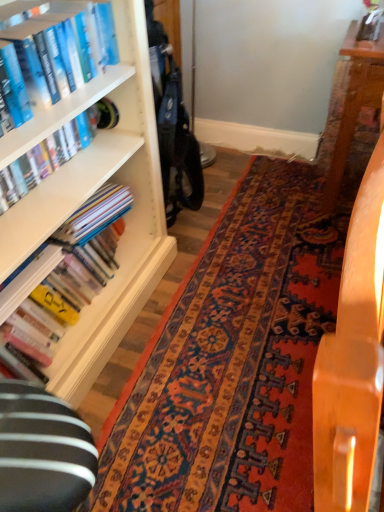
The image size is (384, 512). I want to click on wooden table at center, so click(x=353, y=359).

Measure the distance between blue hardcover book at upper left, acting as the first book starting from the top, and camera.

blue hardcover book at upper left, acting as the first book starting from the top, and camera are 1.02 meters apart from each other.

I want to click on hardcover book at left, which is counted as the 2th book, starting from the bottom, so click(x=46, y=157).

You are a GUI agent. You are given a task and a screenshot of the screen. Output one action in this format:
    pyautogui.click(x=<x>, y=<y>)
    Task: Click on the book above the hardcover book at left, the 2th book when ordered from top to bottom (from the image's perspective)
    This screenshot has height=512, width=384.
    Given the screenshot: What is the action you would take?
    pyautogui.click(x=78, y=34)

Is point (15, 185) closer to camera compared to point (89, 49)?

That is True.

Who is more distant, hardcover book at left, the 2th book when ordered from top to bottom, or blue hardcover book at upper left, which is the third book from bottom to top?

hardcover book at left, the 2th book when ordered from top to bottom, is further away from the camera.

Is hardcover book at left, the 2th book when ordered from top to bottom, with blue hardcover book at upper left, which is the third book from bottom to top?

No, hardcover book at left, the 2th book when ordered from top to bottom, is not in contact with blue hardcover book at upper left, which is the third book from bottom to top.

Are blue hardcover book at upper left, acting as the first book starting from the top, and hardcover book at left, the 2th book when ordered from top to bottom, located far from each other?

blue hardcover book at upper left, acting as the first book starting from the top, is actually quite close to hardcover book at left, the 2th book when ordered from top to bottom.

In the image, is blue hardcover book at upper left, acting as the first book starting from the top, positioned in front of or behind hardcover book at left, the 2th book when ordered from top to bottom?

Clearly, blue hardcover book at upper left, acting as the first book starting from the top, is in front of hardcover book at left, the 2th book when ordered from top to bottom.

Is blue hardcover book at upper left, which is the third book from bottom to top, turned away from hardcover book at left, which is counted as the 2th book, starting from the bottom?

blue hardcover book at upper left, which is the third book from bottom to top, is not turned away from hardcover book at left, which is counted as the 2th book, starting from the bottom.

Would you say blue hardcover book at upper left, acting as the first book starting from the top, is to the left or to the right of hardcover book at left, which is counted as the 2th book, starting from the bottom, in the picture?

blue hardcover book at upper left, acting as the first book starting from the top, is to the left of hardcover book at left, which is counted as the 2th book, starting from the bottom.

From the carpet with intricate patterns at center, count the 3rd book to the left and point to it. Please provide its 2D coordinates.

[(78, 34)]

Considering the relative sizes of carpet with intricate patterns at center and blue hardcover book at upper left, acting as the first book starting from the top, in the image provided, is carpet with intricate patterns at center smaller than blue hardcover book at upper left, acting as the first book starting from the top,?

No.

From a real-world perspective, is carpet with intricate patterns at center physically above blue hardcover book at upper left, acting as the first book starting from the top?

No.

From the image's perspective, relative to blue hardcover book at upper left, acting as the first book starting from the top, is carpet with intricate patterns at center above or below?

carpet with intricate patterns at center is situated lower than blue hardcover book at upper left, acting as the first book starting from the top, in the image.

Which of these two, wooden table at center or blue hardcover book at upper left, which is the third book from bottom to top, stands taller?

Standing taller between the two is wooden table at center.

Is wooden table at center smaller than blue hardcover book at upper left, which is the third book from bottom to top?

Incorrect, wooden table at center is not smaller in size than blue hardcover book at upper left, which is the third book from bottom to top.

How different are the orientations of wooden table at center and blue hardcover book at upper left, which is the third book from bottom to top, in degrees?

The angle between the facing direction of wooden table at center and the facing direction of blue hardcover book at upper left, which is the third book from bottom to top, is 0.00113 degrees.

What's the angular difference between wooden table at center and hardcover book at left, which is counted as the 2th book, starting from the bottom,'s facing directions?

They differ by 0.000695 degrees in their facing directions.

Is wooden table at center aimed at hardcover book at left, the 2th book when ordered from top to bottom?

No, wooden table at center is not aimed at hardcover book at left, the 2th book when ordered from top to bottom.

Considering the relative sizes of wooden table at center and hardcover book at left, which is counted as the 2th book, starting from the bottom, in the image provided, is wooden table at center thinner than hardcover book at left, which is counted as the 2th book, starting from the bottom,?

No, wooden table at center is not thinner than hardcover book at left, which is counted as the 2th book, starting from the bottom.

Is wooden table at center wider or thinner than hardcover books at left, the first book in the bottom-to-top sequence?

Considering their sizes, wooden table at center looks slimmer than hardcover books at left, the first book in the bottom-to-top sequence.

Which is less distant, (366, 489) or (28, 377)?

The point (366, 489) is closer to the camera.

At what (x,y) coordinates should I click in order to perform the action: click on mat behind the wooden table at center. Please return your answer as a coordinate pair (x, y). This screenshot has width=384, height=512. Looking at the image, I should click on [x=232, y=361].

From a real-world perspective, who is located lower, carpet with intricate patterns at center or wooden table at center?

carpet with intricate patterns at center is physically lower.

Relative to wooden table at center, is carpet with intricate patterns at center in front or behind?

carpet with intricate patterns at center is positioned farther from the viewer than wooden table at center.

From the image's perspective, which one is positioned lower, carpet with intricate patterns at center or wooden table at center?

From the image's view, wooden table at center is below.

The width and height of the screenshot is (384, 512). What are the coordinates of `the 2nd book to the right of the blue hardcover book at upper left, acting as the first book starting from the top, starting your count from the anchor` in the screenshot? It's located at (46, 157).

At what (x,y) coordinates should I click in order to perform the action: click on the 2nd book behind when counting from the blue hardcover book at upper left, acting as the first book starting from the top. Please return your answer as a coordinate pair (x, y). The image size is (384, 512). Looking at the image, I should click on (46, 157).

Based on their spatial positions, is wooden table at center or blue hardcover book at upper left, acting as the first book starting from the top, closer to hardcover book at left, which is counted as the 2th book, starting from the bottom?

Among the two, blue hardcover book at upper left, acting as the first book starting from the top, is located nearer to hardcover book at left, which is counted as the 2th book, starting from the bottom.

Looking at the image, which one is located further to blue hardcover book at upper left, acting as the first book starting from the top, hardcover book at left, which is counted as the 2th book, starting from the bottom, or carpet with intricate patterns at center?

carpet with intricate patterns at center is positioned further to the anchor blue hardcover book at upper left, acting as the first book starting from the top.

Looking at the image, which one is located closer to carpet with intricate patterns at center, hardcover book at left, which is counted as the 2th book, starting from the bottom, or blue hardcover book at upper left, which is the third book from bottom to top?

hardcover book at left, which is counted as the 2th book, starting from the bottom, lies closer to carpet with intricate patterns at center than the other object.

Considering their positions, is hardcover books at left, the first book in the bottom-to-top sequence, positioned further to carpet with intricate patterns at center than blue hardcover book at upper left, which is the third book from bottom to top?

blue hardcover book at upper left, which is the third book from bottom to top.

Which object lies further to the anchor point carpet with intricate patterns at center, blue hardcover book at upper left, acting as the first book starting from the top, or hardcover books at left, which ranks as the 3th book in top-to-bottom order?

The object further to carpet with intricate patterns at center is blue hardcover book at upper left, acting as the first book starting from the top.

When comparing their distances from hardcover books at left, which ranks as the 3th book in top-to-bottom order, does hardcover book at left, the 2th book when ordered from top to bottom, or blue hardcover book at upper left, which is the third book from bottom to top, seem further?

blue hardcover book at upper left, which is the third book from bottom to top, lies further to hardcover books at left, which ranks as the 3th book in top-to-bottom order, than the other object.

Looking at the image, which one is located closer to blue hardcover book at upper left, acting as the first book starting from the top, hardcover books at left, the first book in the bottom-to-top sequence, or carpet with intricate patterns at center?

The object closer to blue hardcover book at upper left, acting as the first book starting from the top, is hardcover books at left, the first book in the bottom-to-top sequence.

Looking at the image, which one is located further to wooden table at center, blue hardcover book at upper left, which is the third book from bottom to top, or hardcover book at left, the 2th book when ordered from top to bottom?

Based on the image, hardcover book at left, the 2th book when ordered from top to bottom, appears to be further to wooden table at center.

Identify the location of mat between blue hardcover book at upper left, which is the third book from bottom to top, and wooden table at center vertically. (232, 361).

Find the location of a particular element. This screenshot has width=384, height=512. book located between wooden table at center and hardcover books at left, the first book in the bottom-to-top sequence, in the depth direction is located at coordinates (78, 34).

The height and width of the screenshot is (512, 384). Identify the location of mat between wooden table at center and hardcover books at left, the first book in the bottom-to-top sequence, in the front-back direction. (232, 361).

You are a GUI agent. You are given a task and a screenshot of the screen. Output one action in this format:
    pyautogui.click(x=<x>, y=<y>)
    Task: Click on the book between blue hardcover book at upper left, acting as the first book starting from the top, and hardcover books at left, the first book in the bottom-to-top sequence, in the vertical direction
    
    Given the screenshot: What is the action you would take?
    pyautogui.click(x=46, y=157)